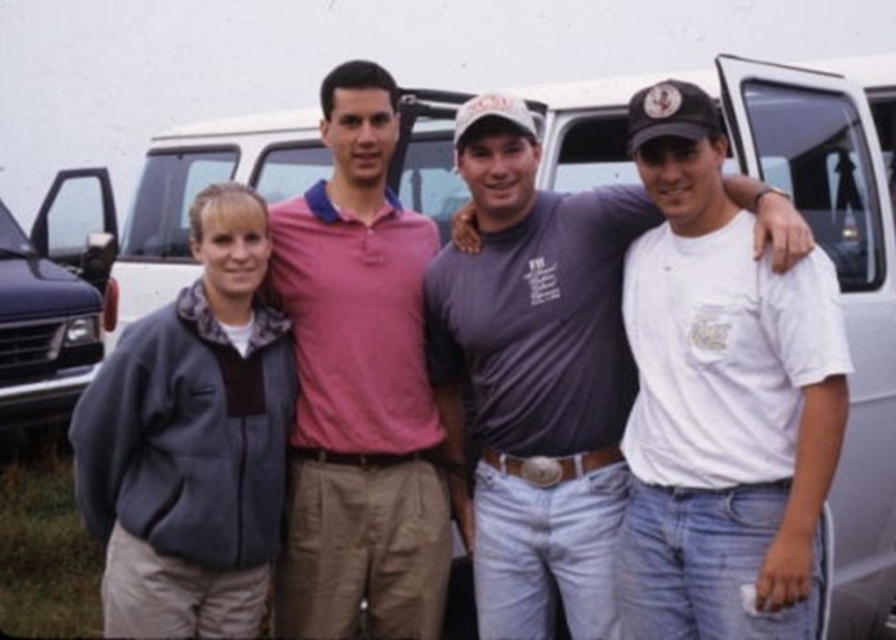
Question: Among these objects, which one is farthest from the camera?

Choices:
 (A) gray fleece jacket at left
 (B) white cotton t-shirt at center
 (C) matte black van at left

Answer: (C)

Question: Does gray cotton t-shirt at center come behind matte black van at left?

Choices:
 (A) no
 (B) yes

Answer: (A)

Question: Is the position of gray cotton t-shirt at center less distant than that of pink cotton polo shirt at center?

Choices:
 (A) no
 (B) yes

Answer: (B)

Question: In this image, where is white cotton t-shirt at center located relative to gray fleece jacket at left?

Choices:
 (A) left
 (B) right

Answer: (B)

Question: Which object is the closest to the gray cotton t-shirt at center?

Choices:
 (A) matte black van at left
 (B) white cotton t-shirt at center

Answer: (B)

Question: Which of these objects is positioned closest to the white matte minivan at center?

Choices:
 (A) gray fleece jacket at left
 (B) white cotton t-shirt at center
 (C) gray cotton t-shirt at center
 (D) matte black van at left

Answer: (D)